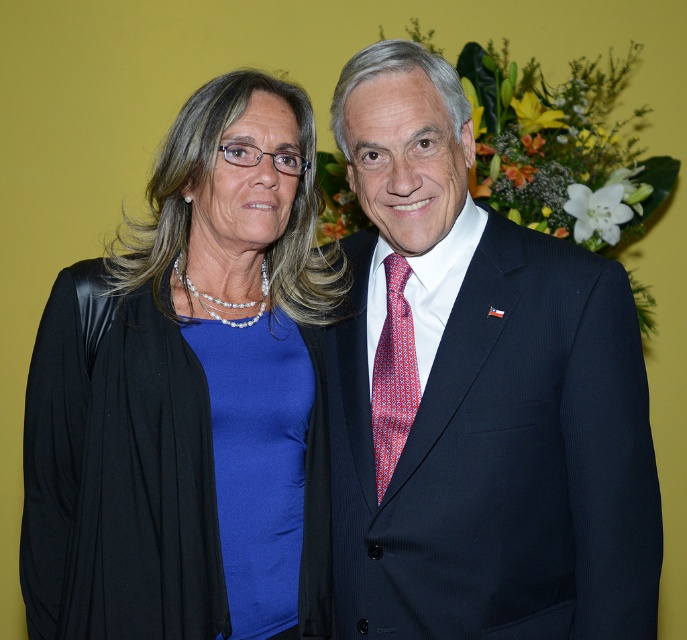
Question: In this image, where is dark blue suit at center located relative to matte blue dress at center?

Choices:
 (A) below
 (B) above

Answer: (B)

Question: Where is matte blue dress at center located in relation to red dotted tie at center in the image?

Choices:
 (A) below
 (B) above

Answer: (A)

Question: Among these objects, which one is nearest to the camera?

Choices:
 (A) matte black blazer at left
 (B) red dotted tie at center
 (C) dark blue suit at center
 (D) matte blue dress at center

Answer: (C)

Question: Which point is farther from the camera taking this photo?

Choices:
 (A) click(262, 388)
 (B) click(238, 483)
 (C) click(374, 410)

Answer: (A)

Question: Is matte blue dress at center closer to camera compared to red dotted tie at center?

Choices:
 (A) yes
 (B) no

Answer: (B)

Question: Which object appears farthest from the camera in this image?

Choices:
 (A) matte blue dress at center
 (B) red dotted tie at center
 (C) matte black blazer at left
 (D) dark blue suit at center

Answer: (A)